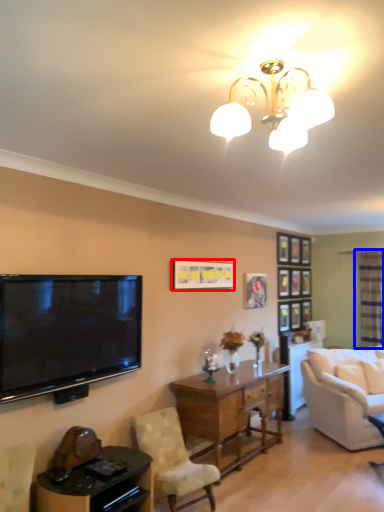
Question: Which point is further to the camera, picture frame (highlighted by a red box) or glass door (highlighted by a blue box)?

Choices:
 (A) picture frame
 (B) glass door

Answer: (B)